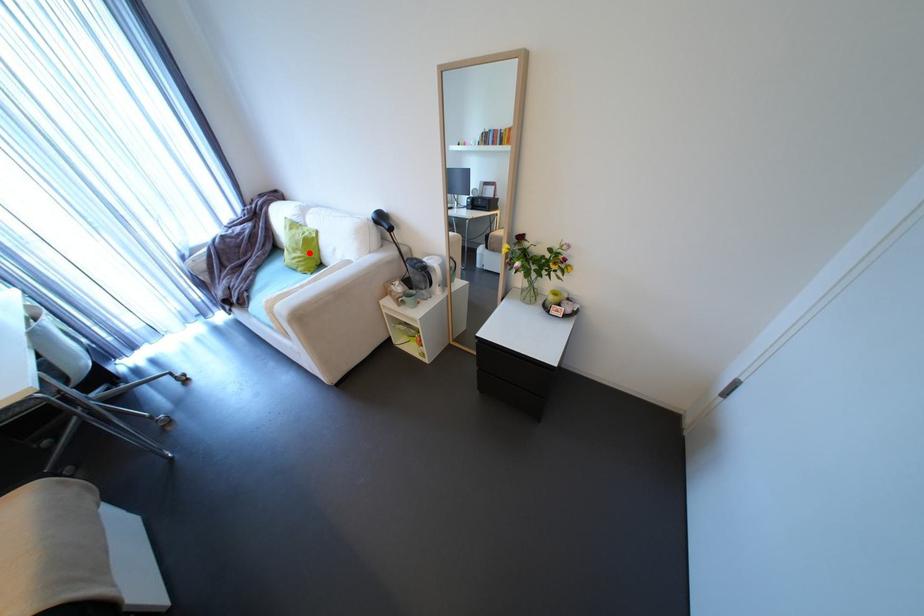
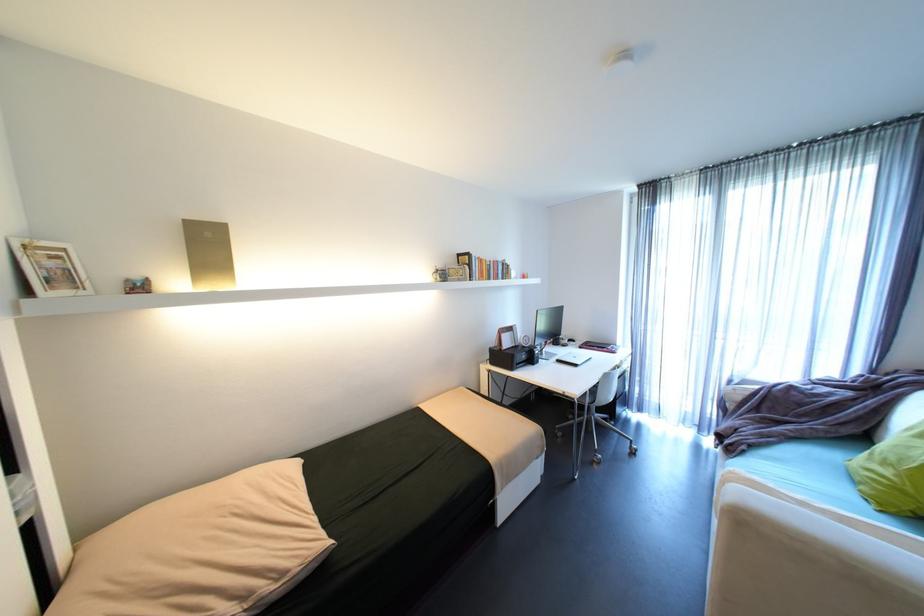
Find the pixel in the second image that matches the highlighted location in the first image.

(906, 476)